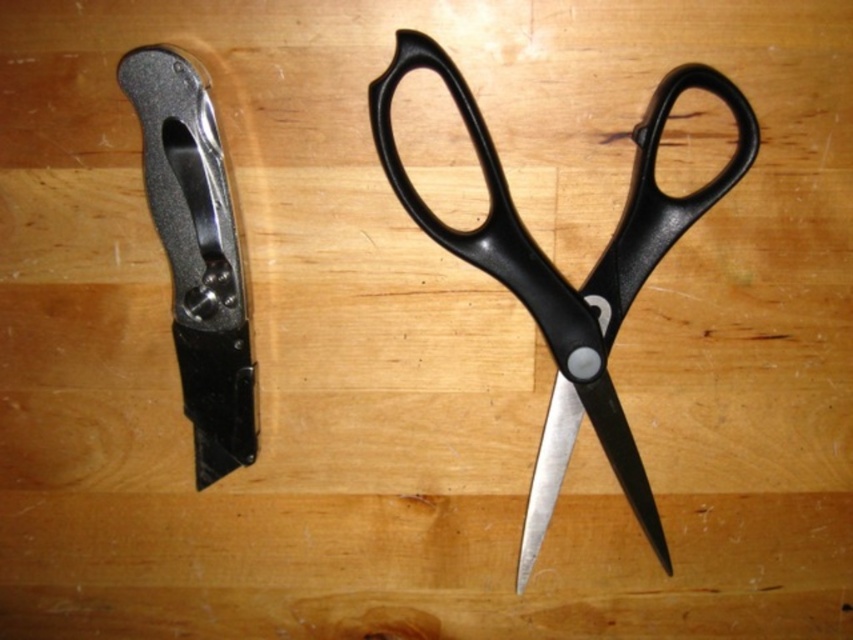
Question: Where is brushed metal utility knife at upper left located in relation to silver metallic blade at center in the image?

Choices:
 (A) above
 (B) below

Answer: (A)

Question: Is the position of black plastic scissors at center more distant than that of brushed metal utility knife at upper left?

Choices:
 (A) yes
 (B) no

Answer: (A)

Question: Which of the following is the farthest from the observer?

Choices:
 (A) silver metallic blade at center
 (B) brushed metal utility knife at upper left

Answer: (A)

Question: Based on their relative distances, which object is nearer to the black plastic scissors at center?

Choices:
 (A) brushed metal utility knife at upper left
 (B) silver metallic blade at center

Answer: (B)

Question: Based on their relative distances, which object is farther from the silver metallic blade at center?

Choices:
 (A) black plastic scissors at center
 (B) brushed metal utility knife at upper left

Answer: (B)

Question: Is black plastic scissors at center behind brushed metal utility knife at upper left?

Choices:
 (A) yes
 (B) no

Answer: (A)